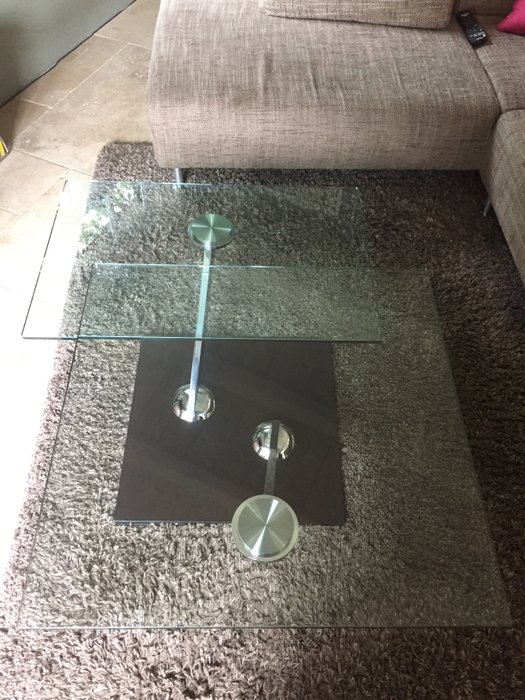
This screenshot has height=700, width=525. In order to click on tv remote control in this screenshot , I will do click(x=471, y=32).